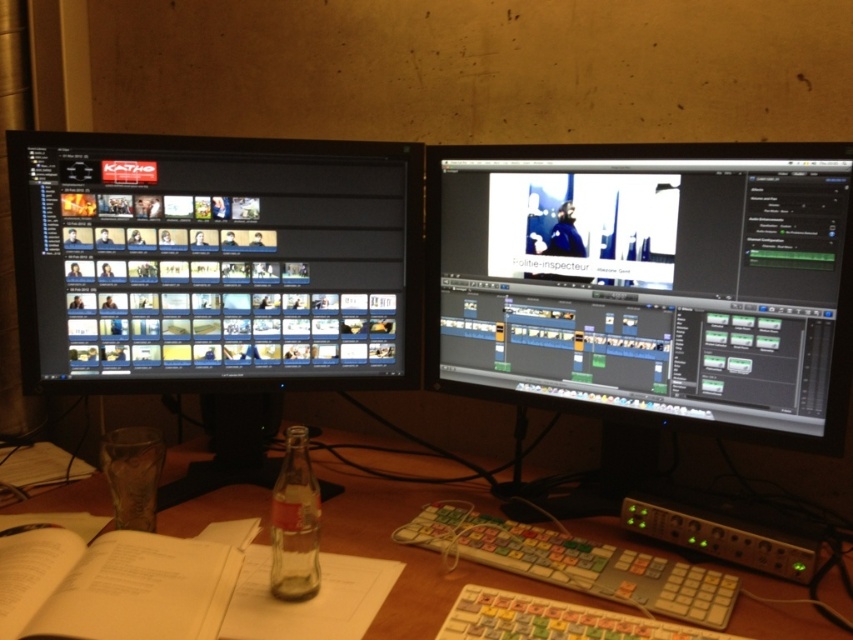
Looking at this image, who is shorter, wooden table at center or white plastic keyboard at lower center?

white plastic keyboard at lower center is shorter.

Which is behind, point (741, 618) or point (457, 500)?

The point (457, 500) is behind.

Who is more forward, (x=379, y=637) or (x=462, y=518)?

Point (x=379, y=637) is more forward.

I want to click on wooden table at center, so click(413, 548).

Does matte black monitor at center have a lesser height compared to clear glass bottle at center?

Incorrect, matte black monitor at center's height does not fall short of clear glass bottle at center's.

Who is shorter, matte black monitor at center or clear glass bottle at center?

With less height is clear glass bottle at center.

Where is `matte black monitor at center`? matte black monitor at center is located at coordinates (647, 282).

Locate an element on the screen. matte black monitor at center is located at coordinates (647, 282).

Is white paper book at lower left thinner than white plastic keyboard at lower center?

Correct, white paper book at lower left's width is less than white plastic keyboard at lower center's.

Is white paper book at lower left closer to camera compared to white plastic keyboard at lower center?

Yes, white paper book at lower left is in front of white plastic keyboard at lower center.

Which is behind, point (38, 600) or point (401, 536)?

Point (401, 536)

Find the location of `white paper book at lower left`. white paper book at lower left is located at coordinates (119, 582).